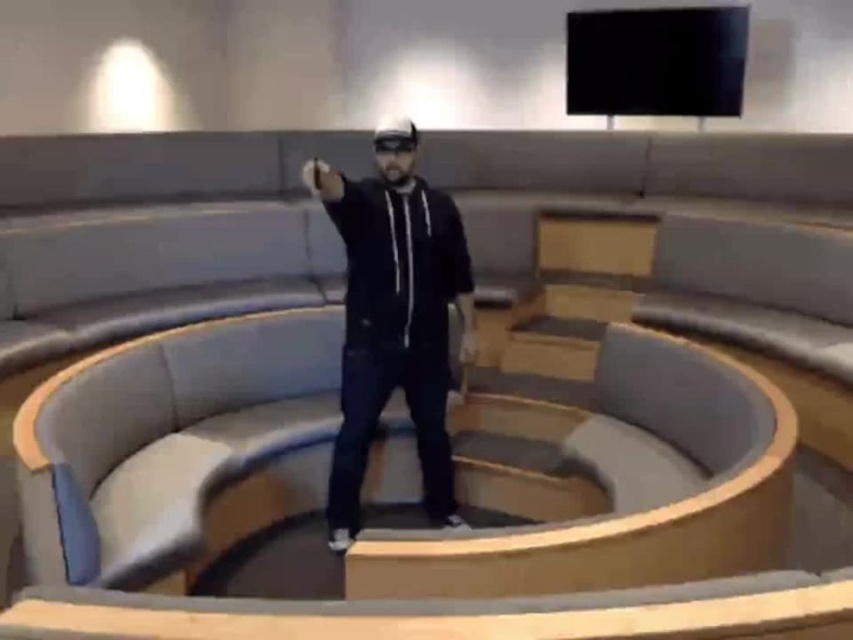
Is black matte hoodie at center thinner than black matte goggles at center?

In fact, black matte hoodie at center might be wider than black matte goggles at center.

Does black matte hoodie at center have a greater height compared to black matte goggles at center?

Indeed, black matte hoodie at center has a greater height compared to black matte goggles at center.

Measure the distance between black matte hoodie at center and camera.

black matte hoodie at center and camera are 2.13 meters apart from each other.

I want to click on black matte hoodie at center, so click(x=393, y=323).